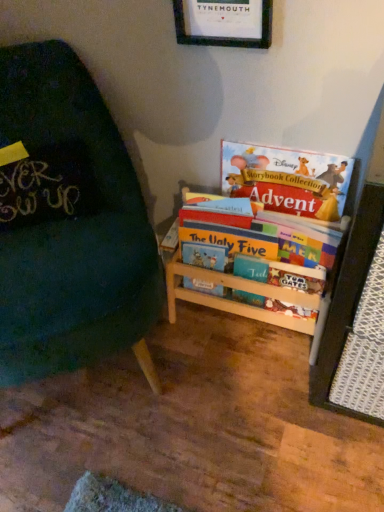
I want to click on matte paper book at upper right, positioned as the first book in top-to-bottom order, so click(x=287, y=179).

You are a GUI agent. You are given a task and a screenshot of the screen. Output one action in this format:
    pyautogui.click(x=<x>, y=<y>)
    Task: Click on the multicolored cardboard bookshelf at right, the 1th book positioned from the bottom
    This screenshot has width=384, height=512.
    Given the screenshot: What is the action you would take?
    pyautogui.click(x=288, y=181)

You are a GUI agent. You are given a task and a screenshot of the screen. Output one action in this format:
    pyautogui.click(x=<x>, y=<y>)
    Task: Click on the matte paper book at upper right, the 2th book ordered from the bottom
    
    Given the screenshot: What is the action you would take?
    pyautogui.click(x=287, y=179)

Does green fabric chair at left have a smaller size compared to multicolored cardboard bookshelf at right, the 1th book positioned from the bottom?

No, green fabric chair at left is not smaller than multicolored cardboard bookshelf at right, the 1th book positioned from the bottom.

Are green fabric chair at left and multicolored cardboard bookshelf at right, which is counted as the 2th book, starting from the top, beside each other?

No.

In terms of width, does green fabric chair at left look wider or thinner when compared to multicolored cardboard bookshelf at right, which is counted as the 2th book, starting from the top?

Considering their sizes, green fabric chair at left looks broader than multicolored cardboard bookshelf at right, which is counted as the 2th book, starting from the top.

Identify the location of chair that is above the multicolored cardboard bookshelf at right, which is counted as the 2th book, starting from the top (from the image's perspective). This screenshot has height=512, width=384. (68, 223).

Does matte paper book at upper right, positioned as the first book in top-to-bottom order, have a larger size compared to green fabric chair at left?

Actually, matte paper book at upper right, positioned as the first book in top-to-bottom order, might be smaller than green fabric chair at left.

Can green fabric chair at left be found inside matte paper book at upper right, the 2th book ordered from the bottom?

No, matte paper book at upper right, the 2th book ordered from the bottom, does not contain green fabric chair at left.

Is matte paper book at upper right, the 2th book ordered from the bottom, oriented away from green fabric chair at left?

No.

Does green fabric chair at left have a lesser height compared to wooden picture frame at upper center?

In fact, green fabric chair at left may be taller than wooden picture frame at upper center.

From the image's perspective, between green fabric chair at left and wooden picture frame at upper center, who is located below?

green fabric chair at left.

The height and width of the screenshot is (512, 384). What are the coordinates of `picture frame on the right of green fabric chair at left` in the screenshot? It's located at (224, 22).

Does multicolored cardboard bookshelf at right, which is counted as the 2th book, starting from the top, turn towards matte paper book at upper right, positioned as the first book in top-to-bottom order?

No, multicolored cardboard bookshelf at right, which is counted as the 2th book, starting from the top, is not facing towards matte paper book at upper right, positioned as the first book in top-to-bottom order.

Is multicolored cardboard bookshelf at right, the 1th book positioned from the bottom, outside of matte paper book at upper right, the 2th book ordered from the bottom?

Indeed, multicolored cardboard bookshelf at right, the 1th book positioned from the bottom, is completely outside matte paper book at upper right, the 2th book ordered from the bottom.

Looking at their sizes, would you say multicolored cardboard bookshelf at right, which is counted as the 2th book, starting from the top, is wider or thinner than matte paper book at upper right, the 2th book ordered from the bottom?

In the image, multicolored cardboard bookshelf at right, which is counted as the 2th book, starting from the top, appears to be wider than matte paper book at upper right, the 2th book ordered from the bottom.

Is multicolored cardboard bookshelf at right, the 1th book positioned from the bottom, to the right of matte paper book at upper right, the 2th book ordered from the bottom, from the viewer's perspective?

Incorrect, multicolored cardboard bookshelf at right, the 1th book positioned from the bottom, is not on the right side of matte paper book at upper right, the 2th book ordered from the bottom.

Are wooden picture frame at upper center and green fabric chair at left making contact?

wooden picture frame at upper center is not next to green fabric chair at left, and they're not touching.

Looking at this image, considering the sizes of objects wooden picture frame at upper center and green fabric chair at left in the image provided, who is shorter, wooden picture frame at upper center or green fabric chair at left?

wooden picture frame at upper center is shorter.

Considering the positions of point (222, 13) and point (69, 309), is point (222, 13) closer or farther from the camera than point (69, 309)?

Point (222, 13) is farther from the camera than point (69, 309).

Considering the positions of objects wooden picture frame at upper center and green fabric chair at left in the image provided, who is behind, wooden picture frame at upper center or green fabric chair at left?

wooden picture frame at upper center is behind.

Consider the image. Would you say green fabric chair at left is inside or outside matte paper book at upper right, positioned as the first book in top-to-bottom order?

green fabric chair at left lies outside matte paper book at upper right, positioned as the first book in top-to-bottom order.

Is there a large distance between green fabric chair at left and matte paper book at upper right, the 2th book ordered from the bottom?

They are positioned close to each other.

From a real-world perspective, which object rests below the other?

From a 3D spatial view, green fabric chair at left is below.

Does point (2, 341) come in front of point (288, 162)?

Yes, point (2, 341) is closer to viewer.

Does matte paper book at upper right, the 2th book ordered from the bottom, appear on the right side of wooden picture frame at upper center?

Yes.

From the image's perspective, is matte paper book at upper right, positioned as the first book in top-to-bottom order, positioned above or below wooden picture frame at upper center?

matte paper book at upper right, positioned as the first book in top-to-bottom order, is situated lower than wooden picture frame at upper center in the image.

Does matte paper book at upper right, positioned as the first book in top-to-bottom order, have a lesser width compared to wooden picture frame at upper center?

Incorrect, the width of matte paper book at upper right, positioned as the first book in top-to-bottom order, is not less than that of wooden picture frame at upper center.

At what (x,y) coordinates should I click in order to perform the action: click on the 1st book to the right when counting from the green fabric chair at left. Please return your answer as a coordinate pair (x, y). Looking at the image, I should click on (288, 181).

This screenshot has height=512, width=384. Find the location of `chair that is below the matte paper book at upper right, the 2th book ordered from the bottom (from the image's perspective)`. chair that is below the matte paper book at upper right, the 2th book ordered from the bottom (from the image's perspective) is located at coordinates (68, 223).

Based on their spatial positions, is green fabric chair at left or matte paper book at upper right, the 2th book ordered from the bottom, further from multicolored cardboard bookshelf at right, which is counted as the 2th book, starting from the top?

Based on the image, green fabric chair at left appears to be further to multicolored cardboard bookshelf at right, which is counted as the 2th book, starting from the top.

Looking at the image, which one is located closer to matte paper book at upper right, positioned as the first book in top-to-bottom order, green fabric chair at left or wooden bookshelf at center?

wooden bookshelf at center is closer to matte paper book at upper right, positioned as the first book in top-to-bottom order.

Estimate the real-world distances between objects in this image. Which object is closer to wooden bookshelf at center, wooden picture frame at upper center or matte paper book at upper right, the 2th book ordered from the bottom?

matte paper book at upper right, the 2th book ordered from the bottom, lies closer to wooden bookshelf at center than the other object.

Estimate the real-world distances between objects in this image. Which object is closer to matte paper book at upper right, positioned as the first book in top-to-bottom order, wooden bookshelf at center or green fabric chair at left?

Among the two, wooden bookshelf at center is located nearer to matte paper book at upper right, positioned as the first book in top-to-bottom order.

Estimate the real-world distances between objects in this image. Which object is closer to matte paper book at upper right, the 2th book ordered from the bottom, wooden picture frame at upper center or green fabric chair at left?

wooden picture frame at upper center lies closer to matte paper book at upper right, the 2th book ordered from the bottom, than the other object.

Which object lies further to the anchor point wooden picture frame at upper center, wooden bookshelf at center or green fabric chair at left?

wooden bookshelf at center is further to wooden picture frame at upper center.

Looking at the image, which one is located further to green fabric chair at left, wooden picture frame at upper center or wooden bookshelf at center?

wooden picture frame at upper center is positioned further to the anchor green fabric chair at left.

Considering their positions, is matte paper book at upper right, the 2th book ordered from the bottom, positioned further to multicolored cardboard bookshelf at right, the 1th book positioned from the bottom, than green fabric chair at left?

green fabric chair at left is positioned further to the anchor multicolored cardboard bookshelf at right, the 1th book positioned from the bottom.

Where is `chair between wooden picture frame at upper center and multicolored cardboard bookshelf at right, which is counted as the 2th book, starting from the top, in the up-down direction`? The image size is (384, 512). chair between wooden picture frame at upper center and multicolored cardboard bookshelf at right, which is counted as the 2th book, starting from the top, in the up-down direction is located at coordinates (68, 223).

In order to click on shelf between green fabric chair at left and matte paper book at upper right, positioned as the first book in top-to-bottom order, in the horizontal direction in this screenshot , I will do [240, 297].

At what (x,y) coordinates should I click in order to perform the action: click on book between matte paper book at upper right, the 2th book ordered from the bottom, and wooden bookshelf at center from top to bottom. Please return your answer as a coordinate pair (x, y). The width and height of the screenshot is (384, 512). Looking at the image, I should click on point(288,181).

Image resolution: width=384 pixels, height=512 pixels. Find the location of `book situated between green fabric chair at left and matte paper book at upper right, the 2th book ordered from the bottom, from left to right`. book situated between green fabric chair at left and matte paper book at upper right, the 2th book ordered from the bottom, from left to right is located at coordinates pos(288,181).